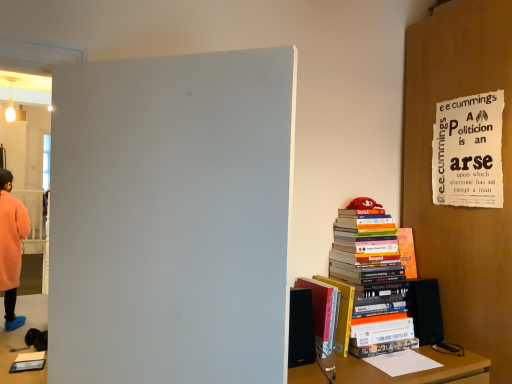
Where is `fluffy pink coat at left`? The image size is (512, 384). fluffy pink coat at left is located at coordinates (11, 247).

Describe the element at coordinates (323, 312) in the screenshot. I see `hardcover book at right, which appears as the 2th book when viewed from the right` at that location.

Identify the location of ripped paper poster at upper right. Image resolution: width=512 pixels, height=384 pixels. (468, 151).

What are the coordinates of `hardcover books at right, which is the second book from left to right` in the screenshot? It's located at pos(369,281).

Considering the positions of objects ripped paper poster at upper right and hardcover books at right, the 1th book from the right, in the image provided, who is more to the right, ripped paper poster at upper right or hardcover books at right, the 1th book from the right,?

Positioned to the right is ripped paper poster at upper right.

Measure the distance from ripped paper poster at upper right to hardcover books at right, the 1th book from the right.

ripped paper poster at upper right and hardcover books at right, the 1th book from the right, are 43.77 centimeters apart from each other.

Locate an element on the screen. the 2nd book behind the ripped paper poster at upper right, counting from the anchor's position is located at coordinates (369, 281).

From the picture: Can you confirm if hardcover books at right, the 1th book from the right, is bigger than ripped paper poster at upper right?

Correct, hardcover books at right, the 1th book from the right, is larger in size than ripped paper poster at upper right.

From the image's perspective, does hardcover books at right, which is the second book from left to right, appear higher than ripped paper poster at upper right?

No, from the image's perspective, hardcover books at right, which is the second book from left to right, is not on top of ripped paper poster at upper right.

Considering the positions of points (373, 318) and (457, 111), is point (373, 318) closer to camera compared to point (457, 111)?

Yes, point (373, 318) is closer to viewer.

Can you confirm if hardcover books at right, which is the second book from left to right, is positioned to the right of ripped paper poster at upper right?

Incorrect, hardcover books at right, which is the second book from left to right, is not on the right side of ripped paper poster at upper right.

From the picture: Is fluffy pink coat at left placed right next to hardcover books at right, which is the second book from left to right?

They are not placed beside each other.

From the image's perspective, would you say fluffy pink coat at left is positioned over hardcover books at right, which is the second book from left to right?

No, from the image's perspective, fluffy pink coat at left is not above hardcover books at right, which is the second book from left to right.

Could you tell me if fluffy pink coat at left is facing hardcover books at right, which is the second book from left to right?

No, fluffy pink coat at left is not aimed at hardcover books at right, which is the second book from left to right.

Is fluffy pink coat at left wider than hardcover books at right, which is the second book from left to right?

Correct, the width of fluffy pink coat at left exceeds that of hardcover books at right, which is the second book from left to right.

Would you consider fluffy pink coat at left to be distant from ripped paper poster at upper right?

Absolutely, fluffy pink coat at left is distant from ripped paper poster at upper right.

How much distance is there between fluffy pink coat at left and ripped paper poster at upper right?

fluffy pink coat at left and ripped paper poster at upper right are 11.81 feet apart.

Does fluffy pink coat at left have a greater height compared to ripped paper poster at upper right?

Correct, fluffy pink coat at left is much taller as ripped paper poster at upper right.

From the picture: From a real-world perspective, is fluffy pink coat at left beneath ripped paper poster at upper right?

Correct, in the physical world, fluffy pink coat at left is lower than ripped paper poster at upper right.

Does hardcover books at right, the 1th book from the right, have a greater width compared to fluffy pink coat at left?

Incorrect, the width of hardcover books at right, the 1th book from the right, does not surpass that of fluffy pink coat at left.

Which object is positioned more to the left, hardcover books at right, the 1th book from the right, or fluffy pink coat at left?

fluffy pink coat at left is more to the left.

From a real-world perspective, is hardcover books at right, the 1th book from the right, under fluffy pink coat at left?

Incorrect, from a real-world perspective, hardcover books at right, the 1th book from the right, is higher than fluffy pink coat at left.

The image size is (512, 384). What are the coordinates of `the 2nd book to the right when counting from the fluffy pink coat at left` in the screenshot? It's located at (369, 281).

Considering the sizes of hardcover book at right, which appears as the 2th book when viewed from the right, and ripped paper poster at upper right in the image, is hardcover book at right, which appears as the 2th book when viewed from the right, wider or thinner than ripped paper poster at upper right?

Considering their sizes, hardcover book at right, which appears as the 2th book when viewed from the right, looks broader than ripped paper poster at upper right.

Is the depth of hardcover book at right, which appears as the 2th book when viewed from the right, greater than that of ripped paper poster at upper right?

Yes, the depth of hardcover book at right, which appears as the 2th book when viewed from the right, is greater than that of ripped paper poster at upper right.

Is hardcover book at right, placed as the first book when sorted from left to right, taller or shorter than ripped paper poster at upper right?

Considering their sizes, hardcover book at right, placed as the first book when sorted from left to right, has less height than ripped paper poster at upper right.

Looking at this image, is hardcover books at right, which is the second book from left to right, taller or shorter than hardcover book at right, which appears as the 2th book when viewed from the right?

hardcover books at right, which is the second book from left to right, is taller than hardcover book at right, which appears as the 2th book when viewed from the right.

From the image's perspective, is hardcover books at right, the 1th book from the right, beneath hardcover book at right, which appears as the 2th book when viewed from the right?

Actually, hardcover books at right, the 1th book from the right, appears above hardcover book at right, which appears as the 2th book when viewed from the right, in the image.

From a real-world perspective, between hardcover books at right, the 1th book from the right, and hardcover book at right, which appears as the 2th book when viewed from the right, who is vertically lower?

hardcover book at right, which appears as the 2th book when viewed from the right, from a real-world perspective.

Can you confirm if hardcover books at right, which is the second book from left to right, is positioned to the right of hardcover book at right, which appears as the 2th book when viewed from the right?

Correct, you'll find hardcover books at right, which is the second book from left to right, to the right of hardcover book at right, which appears as the 2th book when viewed from the right.

From the image's perspective, starting from the ripped paper poster at upper right, which book is the 1st one below? Please provide its 2D coordinates.

[(369, 281)]

Find the location of `poster page that appears in front of the hardcover books at right, which is the second book from left to right`. poster page that appears in front of the hardcover books at right, which is the second book from left to right is located at coordinates (468, 151).

Estimate the real-world distances between objects in this image. Which object is further from hardcover book at right, which appears as the 2th book when viewed from the right, hardcover books at right, the 1th book from the right, or ripped paper poster at upper right?

The object further to hardcover book at right, which appears as the 2th book when viewed from the right, is ripped paper poster at upper right.

When comparing their distances from hardcover books at right, the 1th book from the right, does hardcover book at right, placed as the first book when sorted from left to right, or fluffy pink coat at left seem further?

Based on the image, fluffy pink coat at left appears to be further to hardcover books at right, the 1th book from the right.

Estimate the real-world distances between objects in this image. Which object is closer to ripped paper poster at upper right, fluffy pink coat at left or hardcover books at right, the 1th book from the right?

hardcover books at right, the 1th book from the right.

Which object lies further to the anchor point fluffy pink coat at left, ripped paper poster at upper right or hardcover books at right, the 1th book from the right?

Among the two, ripped paper poster at upper right is located further to fluffy pink coat at left.

Which object lies nearer to the anchor point ripped paper poster at upper right, hardcover book at right, which appears as the 2th book when viewed from the right, or fluffy pink coat at left?

hardcover book at right, which appears as the 2th book when viewed from the right.

From the image, which object appears to be nearer to fluffy pink coat at left, hardcover book at right, which appears as the 2th book when viewed from the right, or hardcover books at right, the 1th book from the right?

hardcover book at right, which appears as the 2th book when viewed from the right, lies closer to fluffy pink coat at left than the other object.

Based on their spatial positions, is ripped paper poster at upper right or hardcover book at right, which appears as the 2th book when viewed from the right, closer to fluffy pink coat at left?

Based on the image, hardcover book at right, which appears as the 2th book when viewed from the right, appears to be nearer to fluffy pink coat at left.

Based on their spatial positions, is hardcover book at right, which appears as the 2th book when viewed from the right, or ripped paper poster at upper right further from fluffy pink coat at left?

Based on the image, ripped paper poster at upper right appears to be further to fluffy pink coat at left.

Identify the location of book between fluffy pink coat at left and hardcover books at right, the 1th book from the right. (323, 312).

Locate an element on the screen. The image size is (512, 384). book between ripped paper poster at upper right and hardcover book at right, which appears as the 2th book when viewed from the right, in the up-down direction is located at coordinates (369, 281).